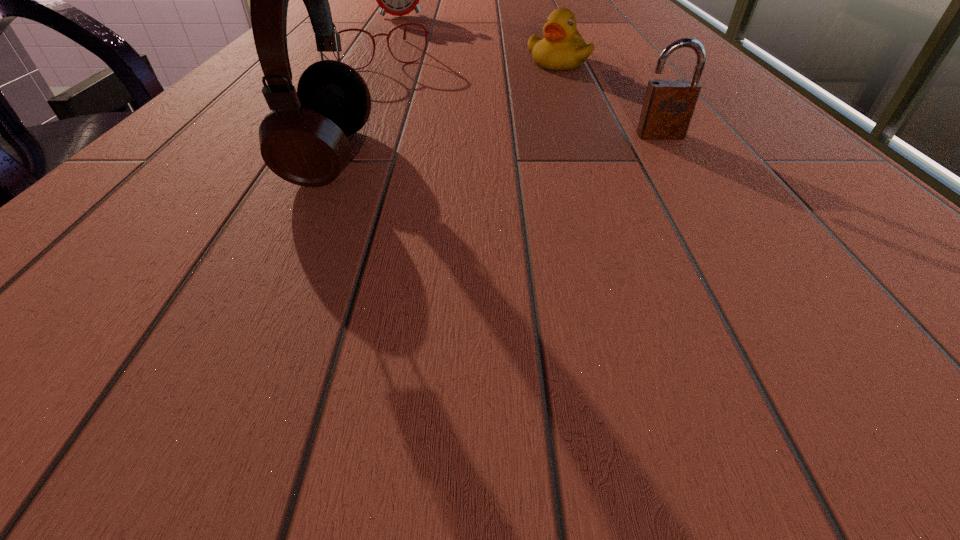
The image size is (960, 540). Identify the location of vacant area that lies between the tallest object and the padlock. (495, 146).

Locate an element on the screen. The width and height of the screenshot is (960, 540). free point between the shortest object and the duckling is located at coordinates (466, 59).

Where is `vacant point located between the fourth object from left to right and the spectacles`? This screenshot has height=540, width=960. vacant point located between the fourth object from left to right and the spectacles is located at coordinates (466, 59).

Select which object appears as the third closest to the padlock. Please provide its 2D coordinates. Your answer should be formatted as a tuple, i.e. [(x, y)], where the tuple contains the x and y coordinates of a point satisfying the conditions above.

[(425, 31)]

The image size is (960, 540). Find the location of `object that is the nearest to the headset`. object that is the nearest to the headset is located at coordinates (425, 31).

Image resolution: width=960 pixels, height=540 pixels. What are the coordinates of `free space that satisfies the following two spatial constraints: 1. on the front side of the fourth object from left to right; 2. on the left side of the farthest object` in the screenshot? It's located at (377, 62).